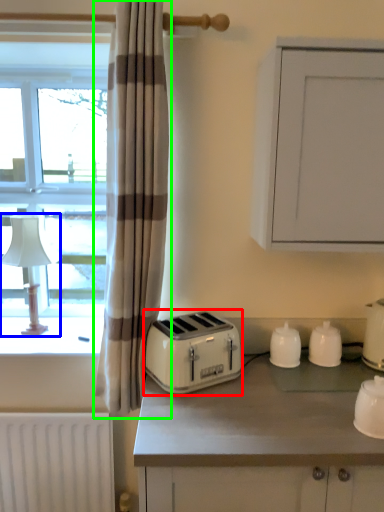
Question: Considering the real-world distances, which object is farthest from toaster (highlighted by a red box)? table lamp (highlighted by a blue box) or curtain (highlighted by a green box)?

Choices:
 (A) table lamp
 (B) curtain

Answer: (A)